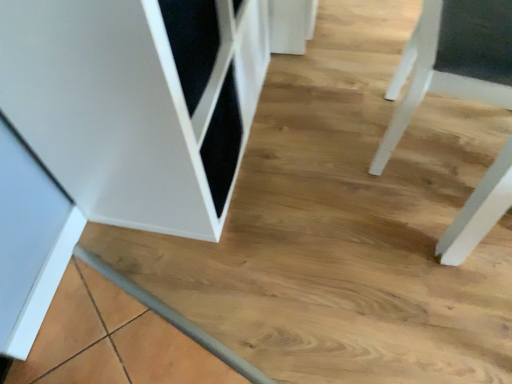
Find the location of `white matte chair at right`. white matte chair at right is located at coordinates (453, 61).

What do you see at coordinates (453, 61) in the screenshot? I see `white matte chair at right` at bounding box center [453, 61].

At what (x,y) coordinates should I click in order to perform the action: click on white matte chair at right. Please return your answer as a coordinate pair (x, y). Looking at the image, I should click on (453, 61).